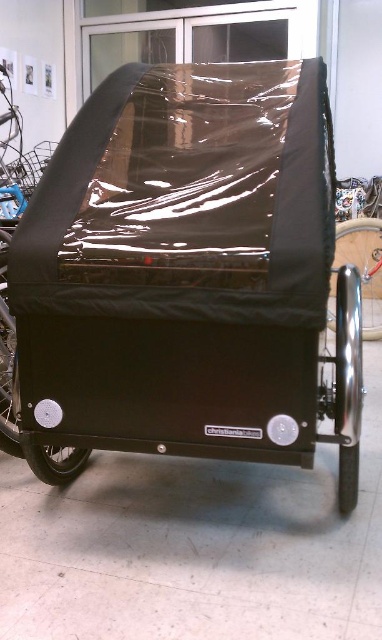
Is polished silver wheel at lower right to the right of black metallic wheel at right from the viewer's perspective?

No, polished silver wheel at lower right is not to the right of black metallic wheel at right.

Which of these two, polished silver wheel at lower right or black metallic wheel at right, stands shorter?

polished silver wheel at lower right is shorter.

Between point (352, 337) and point (373, 230), which one is positioned in front?

Point (352, 337)

This screenshot has width=382, height=640. Find the location of `polished silver wheel at lower right`. polished silver wheel at lower right is located at coordinates (348, 384).

Is the position of black matte baby carriage at center more distant than that of polished silver wheel at lower right?

No, it is in front of polished silver wheel at lower right.

Where is `black matte baby carriage at center`? The image size is (382, 640). black matte baby carriage at center is located at coordinates (179, 269).

Does point (215, 392) come closer to viewer compared to point (351, 248)?

Yes.

Who is more distant from viewer, (181,200) or (370,298)?

The point (370,298) is more distant.

Locate an element on the screen. The width and height of the screenshot is (382, 640). black matte baby carriage at center is located at coordinates click(179, 269).